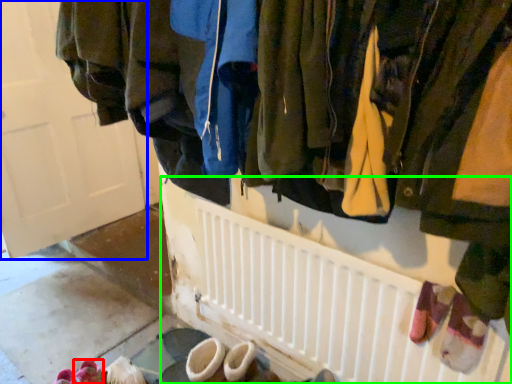
Question: Considering the real-world distances, which object is closest to footwear (highlighted by a red box)? door (highlighted by a blue box) or radiator (highlighted by a green box).

Choices:
 (A) door
 (B) radiator

Answer: (B)